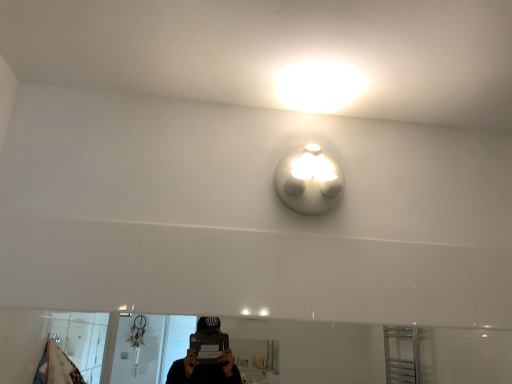
Question: Considering the positions of white glossy mirror at lower center and white matte light fixture at upper center in the image, is white glossy mirror at lower center bigger or smaller than white matte light fixture at upper center?

Choices:
 (A) big
 (B) small

Answer: (A)

Question: In terms of width, does white glossy mirror at lower center look wider or thinner when compared to white matte light fixture at upper center?

Choices:
 (A) wide
 (B) thin

Answer: (B)

Question: Considering the positions of white glossy mirror at lower center and white matte light fixture at upper center in the image, is white glossy mirror at lower center taller or shorter than white matte light fixture at upper center?

Choices:
 (A) tall
 (B) short

Answer: (B)

Question: Is white matte light fixture at upper center in front of or behind white glossy mirror at lower center in the image?

Choices:
 (A) behind
 (B) front

Answer: (A)

Question: Is white matte light fixture at upper center wider or thinner than white glossy mirror at lower center?

Choices:
 (A) thin
 (B) wide

Answer: (B)

Question: From a real-world perspective, relative to white glossy mirror at lower center, is white matte light fixture at upper center vertically above or below?

Choices:
 (A) above
 (B) below

Answer: (A)

Question: Does point (301, 157) appear closer or farther from the camera than point (350, 360)?

Choices:
 (A) farther
 (B) closer

Answer: (B)